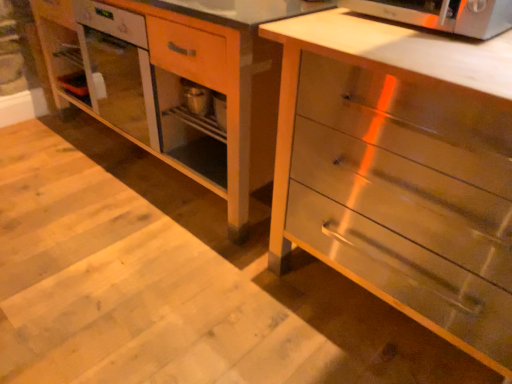
Question: Is point (317, 150) closer or farther from the camera than point (430, 4)?

Choices:
 (A) farther
 (B) closer

Answer: (A)

Question: Is metallic silver chest of drawers at center in front of or behind satin silver microwave oven at upper right in the image?

Choices:
 (A) front
 (B) behind

Answer: (A)

Question: Estimate the real-world distances between objects in this image. Which object is closer to the metallic silver chest of drawers at center?

Choices:
 (A) wooden vanity at center
 (B) satin silver microwave oven at upper right

Answer: (B)

Question: Which of these objects is positioned closest to the wooden vanity at center?

Choices:
 (A) metallic silver chest of drawers at center
 (B) satin silver microwave oven at upper right

Answer: (A)